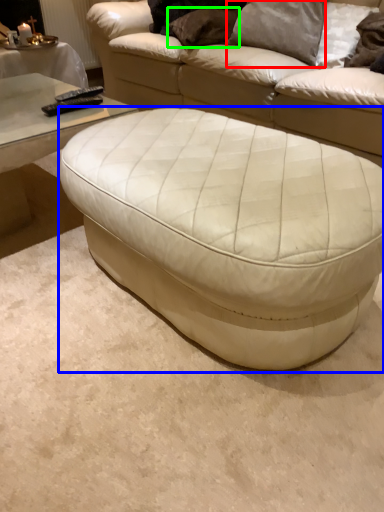
Question: Considering the real-world distances, which object is farthest from pillow (highlighted by a red box)? table (highlighted by a blue box) or pillow (highlighted by a green box)?

Choices:
 (A) table
 (B) pillow

Answer: (A)